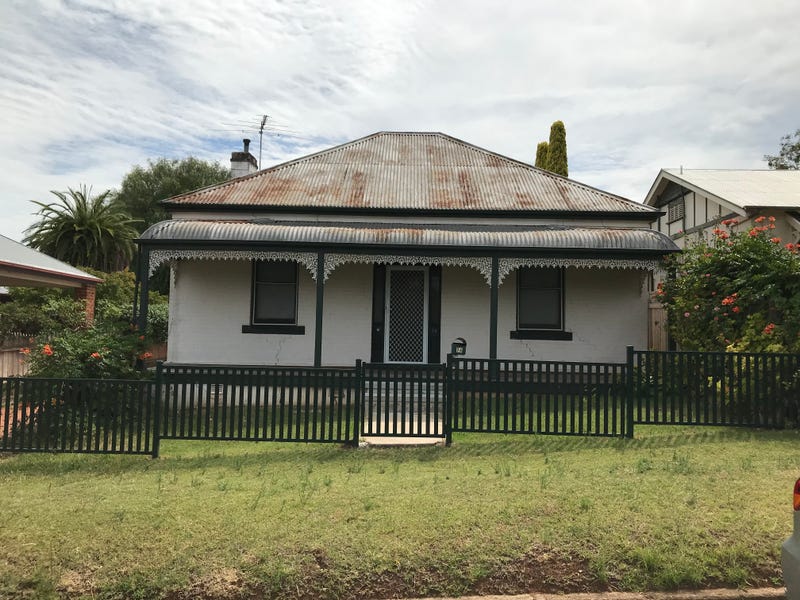
Identify the location of chimney. The height and width of the screenshot is (600, 800). (238, 162).